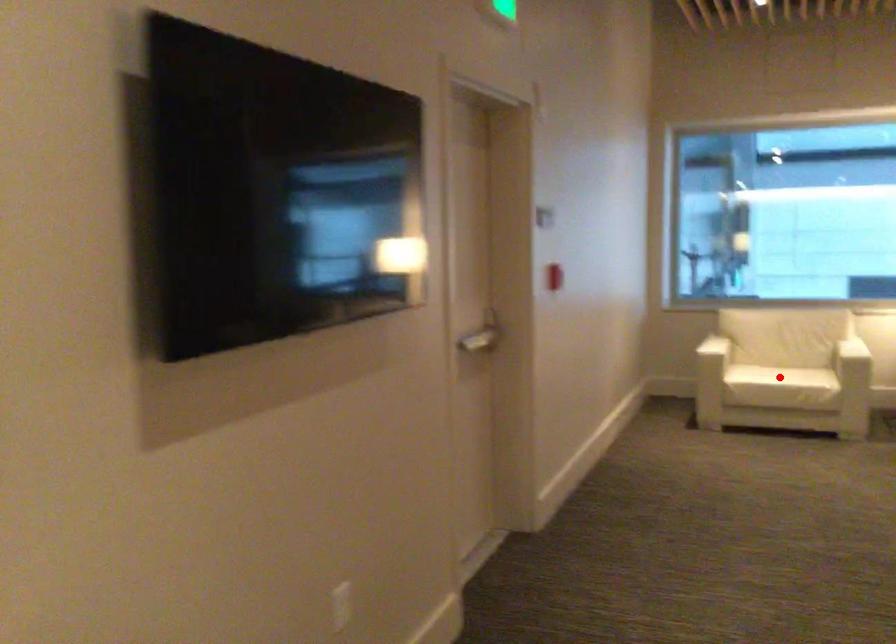
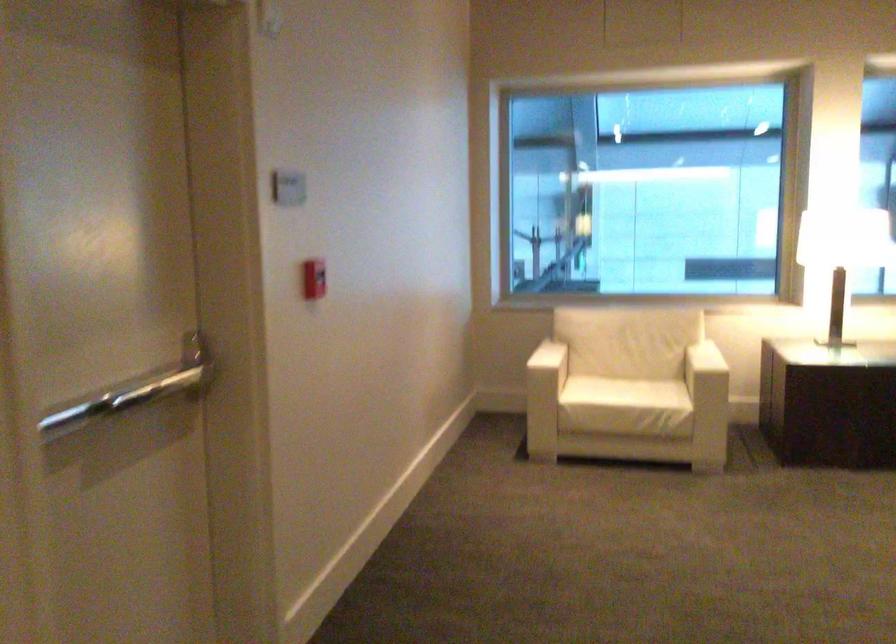
Question: I am providing you with two images of the same scene from different viewpoints. Image1 has a red point marked. In image2, the corresponding 3D location appears at what relative position? Reply with the corresponding letter.

Choices:
 (A) Closer
 (B) Farther

Answer: (A)